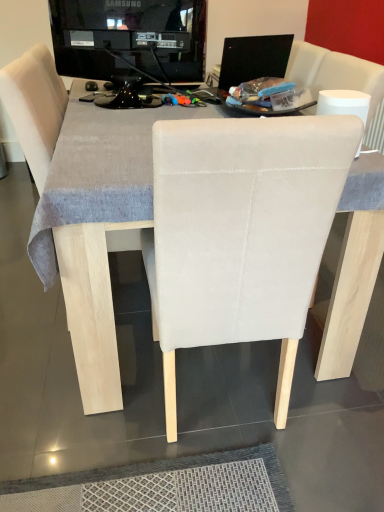
Where is `black glossy television at upper center`? Image resolution: width=384 pixels, height=512 pixels. black glossy television at upper center is located at coordinates (129, 38).

What do you see at coordinates (129, 38) in the screenshot? Image resolution: width=384 pixels, height=512 pixels. I see `black glossy television at upper center` at bounding box center [129, 38].

Locate an element on the screen. Image resolution: width=384 pixels, height=512 pixels. black glossy television at upper center is located at coordinates (129, 38).